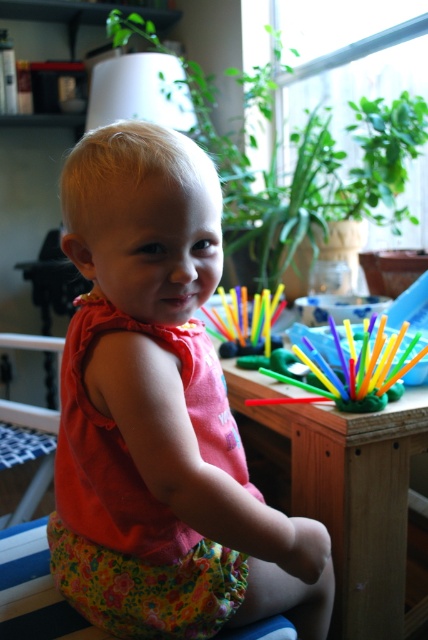
What is located at the coordinates point (160, 413) in the image?

The point (160, 413) indicates the location of the pink fabric dress at center.

You are standing in the room and want to reach both the point at (x=160, y=540) and the point at (x=368, y=371). Which point will you reach first if you move straight towards them?

You will reach point (x=160, y=540) first because it is closer to you than point (x=368, y=371).

You have a rectangular box that is 2 feet wide. You want to place it on either the wooden table at center or the floral fabric chair at lower left. Which surface can it fit on?

The wooden table at center can fit the rectangular box because its width is larger than the floral fabric chair at lower left.